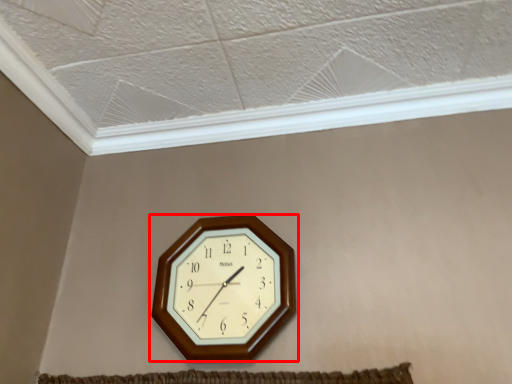
Question: From the image's perspective, what is the correct spatial relationship of wall clock (annotated by the red box) in relation to window frame?

Choices:
 (A) above
 (B) below

Answer: (B)